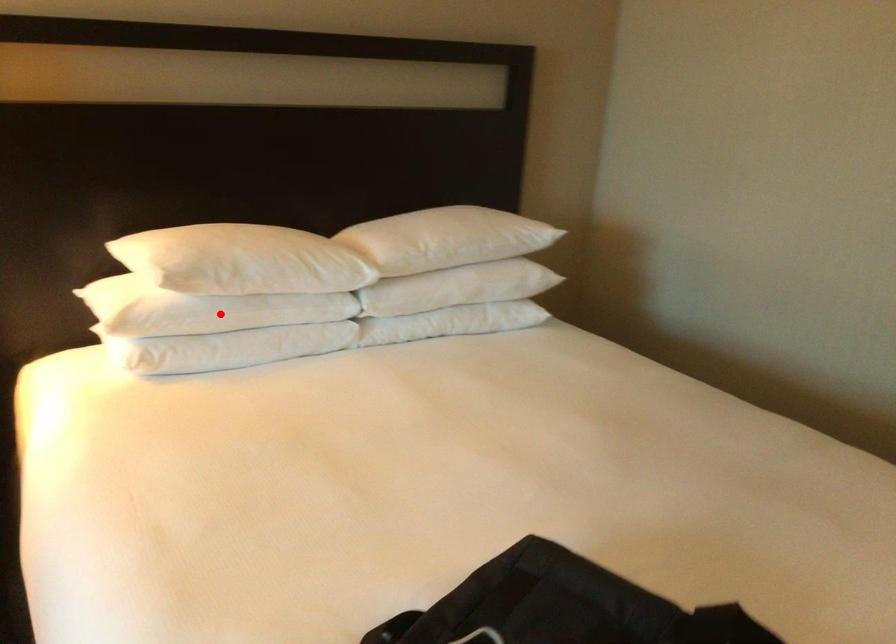
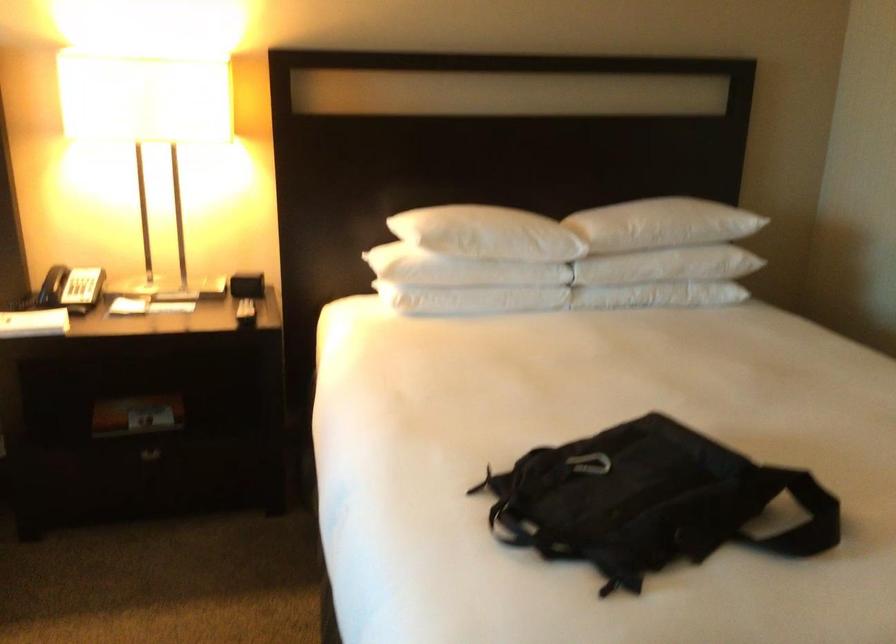
In the second image, find the point that corresponds to the highlighted location in the first image.

(460, 270)